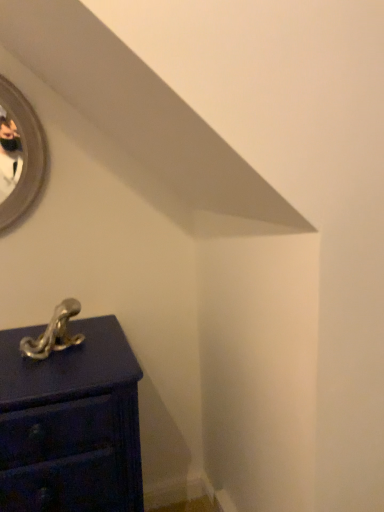
Question: Is point pyautogui.click(x=71, y=415) closer or farther from the camera than point pyautogui.click(x=71, y=343)?

Choices:
 (A) farther
 (B) closer

Answer: (B)

Question: From the image's perspective, is matte dark blue chest of drawers at lower left above or below polished silver hook at lower left?

Choices:
 (A) below
 (B) above

Answer: (A)

Question: In terms of height, does matte dark blue chest of drawers at lower left look taller or shorter compared to polished silver hook at lower left?

Choices:
 (A) tall
 (B) short

Answer: (A)

Question: Looking at their shapes, would you say polished silver hook at lower left is wider or thinner than matte dark blue chest of drawers at lower left?

Choices:
 (A) wide
 (B) thin

Answer: (B)

Question: Is polished silver hook at lower left spatially inside matte dark blue chest of drawers at lower left, or outside of it?

Choices:
 (A) outside
 (B) inside

Answer: (A)

Question: In terms of height, does polished silver hook at lower left look taller or shorter compared to matte dark blue chest of drawers at lower left?

Choices:
 (A) short
 (B) tall

Answer: (A)

Question: Considering the positions of point (72, 315) and point (130, 349), is point (72, 315) closer or farther from the camera than point (130, 349)?

Choices:
 (A) farther
 (B) closer

Answer: (B)